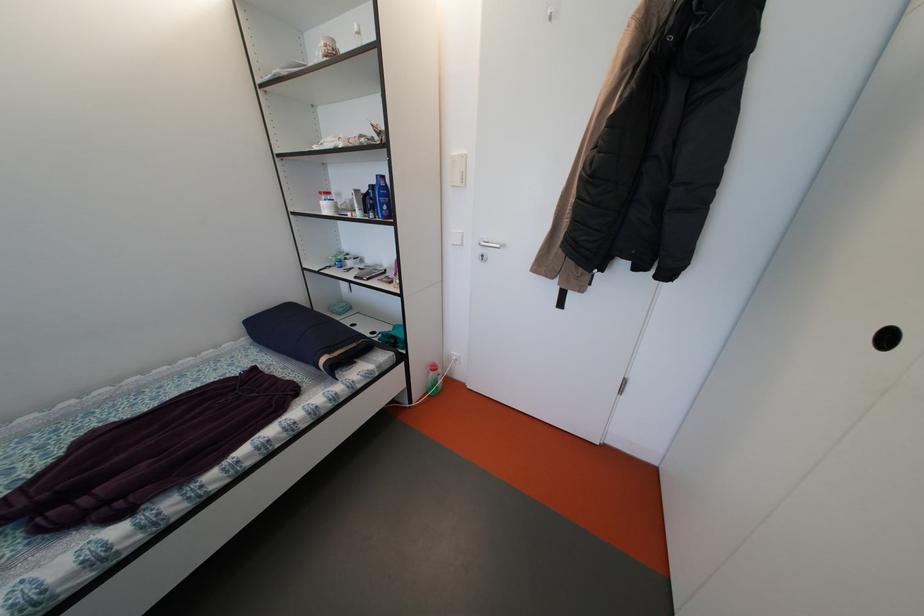
Describe the element at coordinates (433, 379) in the screenshot. The width and height of the screenshot is (924, 616). I see `a red dish soap` at that location.